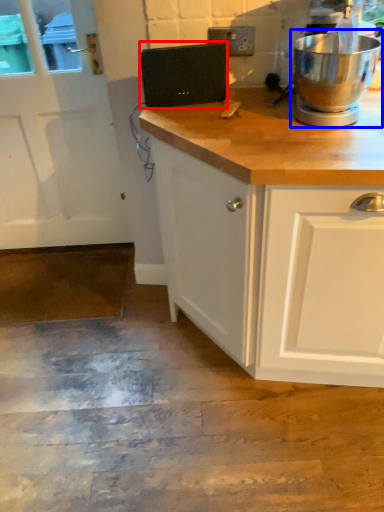
Question: Which object appears closest to the camera in this image, appliance (highlighted by a red box) or home appliance (highlighted by a blue box)?

Choices:
 (A) appliance
 (B) home appliance

Answer: (B)